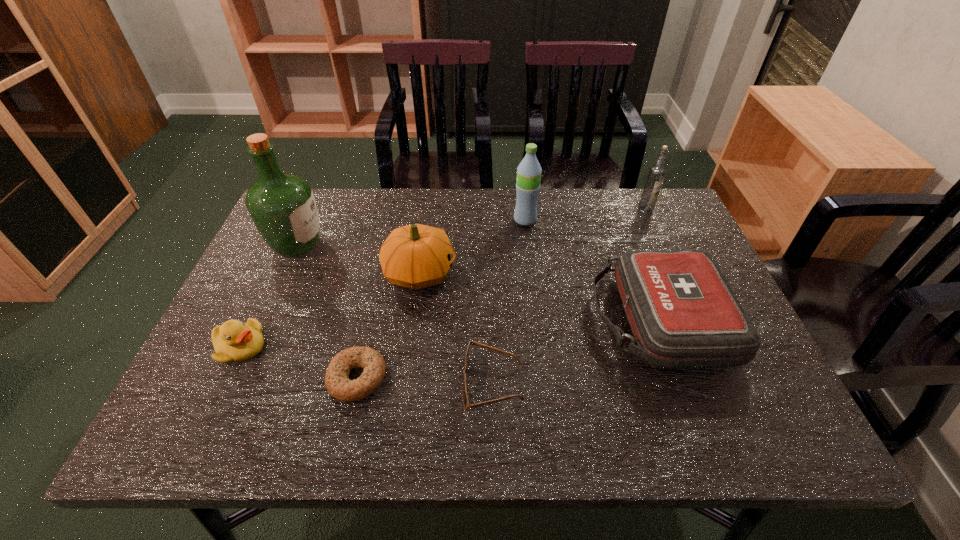
Where is `the tallest object`? The width and height of the screenshot is (960, 540). the tallest object is located at coordinates pyautogui.click(x=282, y=206).

Find the location of a particular element. the sixth object from left to right is located at coordinates (529, 170).

Where is `vodka`? vodka is located at coordinates (656, 174).

Find the location of `gourd`. gourd is located at coordinates (415, 256).

Where is `the first-aid kit`? Image resolution: width=960 pixels, height=540 pixels. the first-aid kit is located at coordinates (683, 314).

I want to click on duckling, so 233,341.

The height and width of the screenshot is (540, 960). I want to click on the fifth object from left to right, so pyautogui.click(x=466, y=404).

The height and width of the screenshot is (540, 960). In order to click on sunglasses in this screenshot , I will do `click(466, 404)`.

What are the coordinates of `the shortest object` in the screenshot? It's located at (337, 382).

Where is `blank space located 0.120m on the front-facing side of the tallest object`? The image size is (960, 540). blank space located 0.120m on the front-facing side of the tallest object is located at coordinates (370, 245).